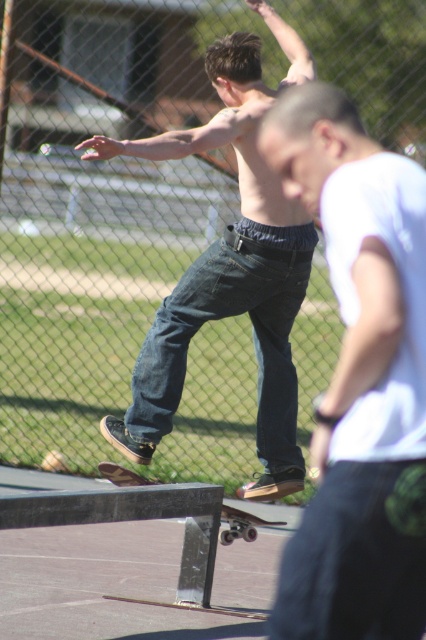
Does point (170, 381) come closer to viewer compared to point (117, 468)?

Yes, point (170, 381) is in front of point (117, 468).

Between brown leather shoes at center and wooden skateboard at center, which one appears on the right side from the viewer's perspective?

wooden skateboard at center

Which is in front, point (222, 60) or point (100, 467)?

Point (222, 60)

Where is `brown leather shoes at center`? This screenshot has height=640, width=426. brown leather shoes at center is located at coordinates (227, 278).

Does white matte shirt at center have a larger size compared to wooden skateboard at center?

Indeed, white matte shirt at center has a larger size compared to wooden skateboard at center.

What do you see at coordinates (359, 380) in the screenshot?
I see `white matte shirt at center` at bounding box center [359, 380].

I want to click on white matte shirt at center, so click(359, 380).

Can you confirm if white matte shirt at center is bigger than brown leather shoes at center?

No.

Who is lower down, white matte shirt at center or brown leather shoes at center?

white matte shirt at center is below.

Locate an element on the screen. white matte shirt at center is located at coordinates (359, 380).

What are the coordinates of `white matte shirt at center` in the screenshot? It's located at (359, 380).